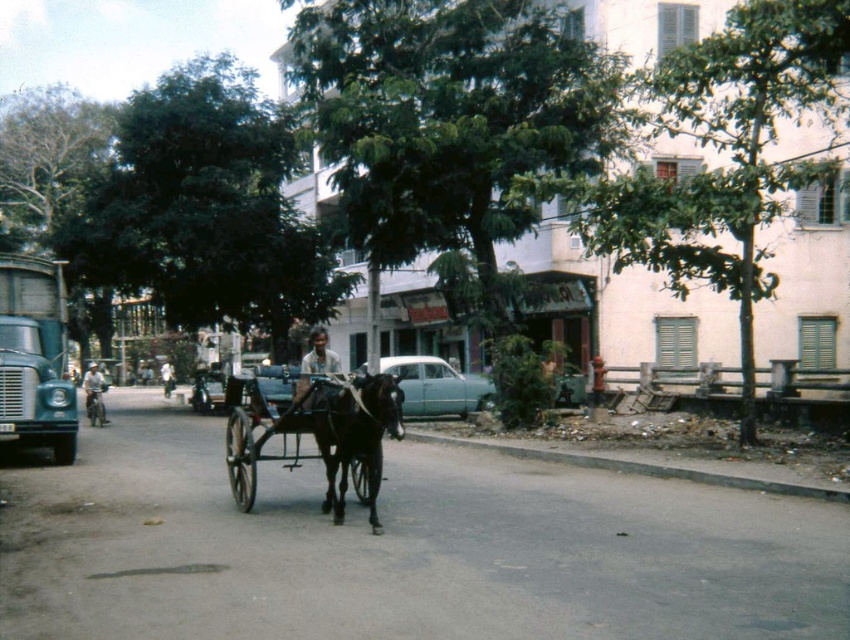
Looking at this image, can you confirm if light blue shirt at left is positioned to the left of white matte shirt at center?

Yes, light blue shirt at left is to the left of white matte shirt at center.

Is light blue shirt at left positioned at the back of white matte shirt at center?

That is False.

Describe the element at coordinates (94, 394) in the screenshot. I see `light blue shirt at left` at that location.

This screenshot has height=640, width=850. What are the coordinates of `light blue shirt at left` in the screenshot? It's located at (94, 394).

Is shiny black cart at center above light blue metallic car at center?

No.

Where is `shiny black cart at center`? Image resolution: width=850 pixels, height=640 pixels. shiny black cart at center is located at coordinates (321, 436).

Does light blue metallic car at center appear under light brown skin at center?

Yes.

Between light blue metallic car at center and light brown skin at center, which one is positioned higher?

Positioned higher is light brown skin at center.

Who is more forward, (412,364) or (314,352)?

Point (314,352) is in front.

Identify the location of light blue metallic car at center. (437, 387).